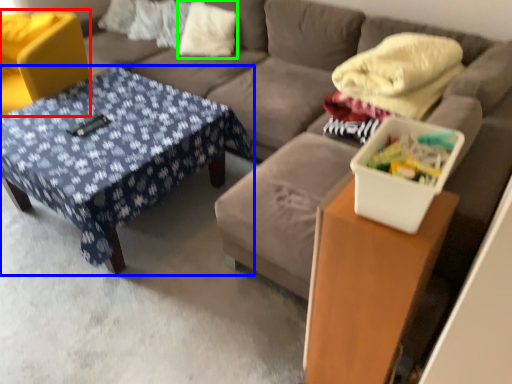
Question: Which is farther away from swivel chair (highlighted by a red box)? table (highlighted by a blue box) or pillow (highlighted by a green box)?

Choices:
 (A) table
 (B) pillow

Answer: (B)